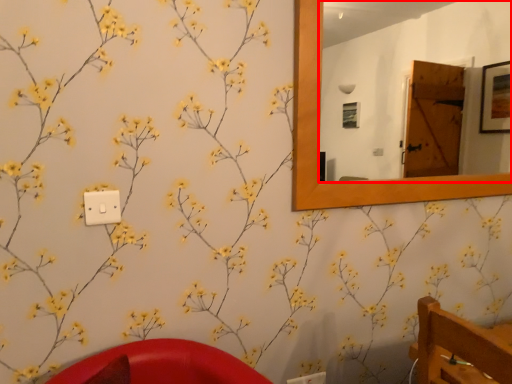
Question: In this image, where is mirror (annotated by the red box) located relative to light switch?

Choices:
 (A) left
 (B) right

Answer: (B)